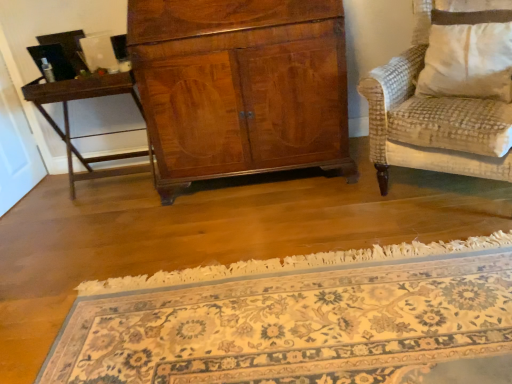
Identify the location of vacant space underneath dark brown wood table at left (from a real-world perspective). This screenshot has height=384, width=512. (126, 184).